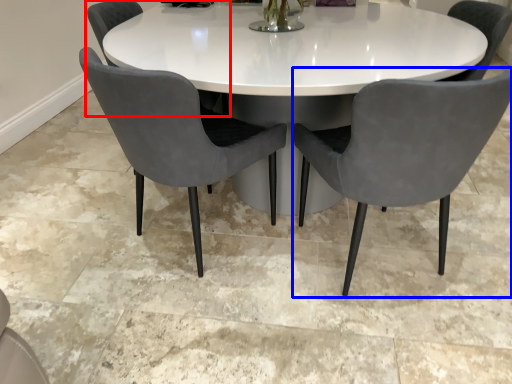
Question: Which of the following is the closest to the observer, chair (highlighted by a red box) or chair (highlighted by a blue box)?

Choices:
 (A) chair
 (B) chair

Answer: (B)